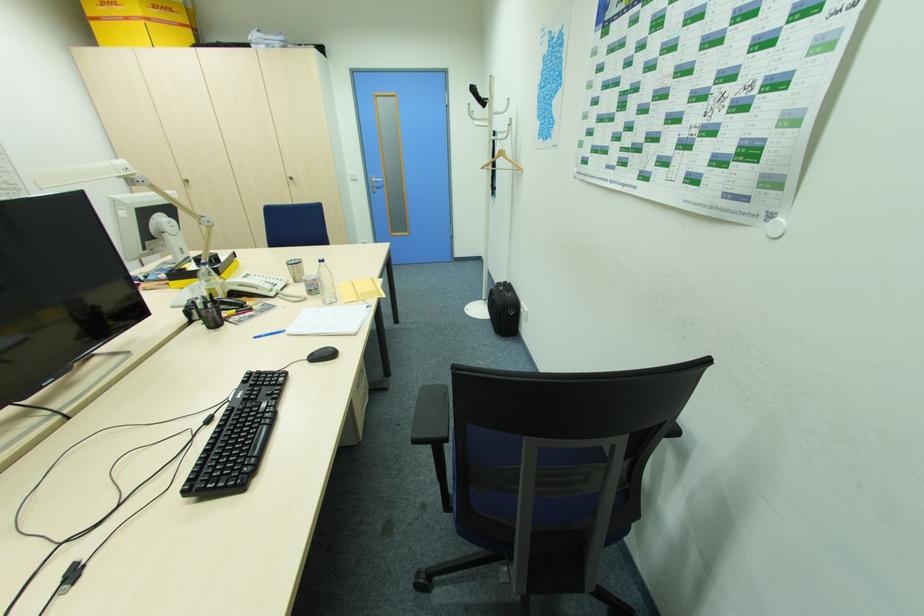
Where is `black computer mouse`? Image resolution: width=924 pixels, height=616 pixels. black computer mouse is located at coordinates (322, 354).